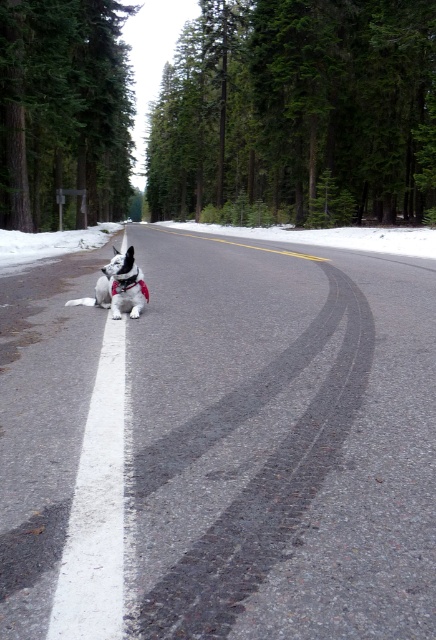
You are a photographer standing at the edge of the road in the winter scene. You want to take a photo that includes both the point at coordinates point (303,234) and point (109,294). Which point should you focus on first to ensure both are in sharp focus?

You should focus on point (303,234) first because it is closer to the camera than point (109,294). This ensures both points will be in focus as the depth of field will cover the distance between them.

You are a pedestrian walking along the road and see the white powdery snow at road center and the white fur dog at center. Which object is located to the right of the other?

The white powdery snow at road center is to the right of the white fur dog at center.

You are a hiker walking along the road and see the white powdery snow at left and the white fur dog at center. Which object is higher up from the ground?

The white powdery snow at left is above the white fur dog at center, so the white powdery snow at left is higher up from the ground.